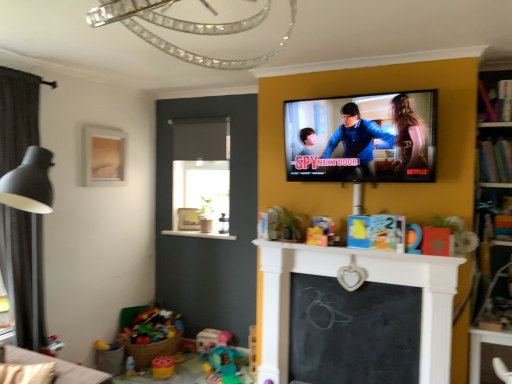
I want to click on vacant area that lies in front of translucent plastic cup at lower left, the 2th toy in the front-to-back sequence, so click(x=134, y=379).